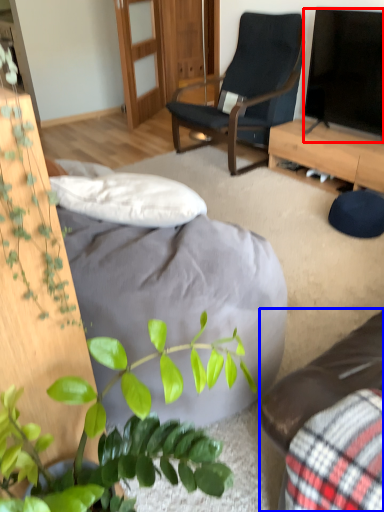
Question: Which object is further to the camera taking this photo, television (highlighted by a red box) or studio couch (highlighted by a blue box)?

Choices:
 (A) television
 (B) studio couch

Answer: (A)